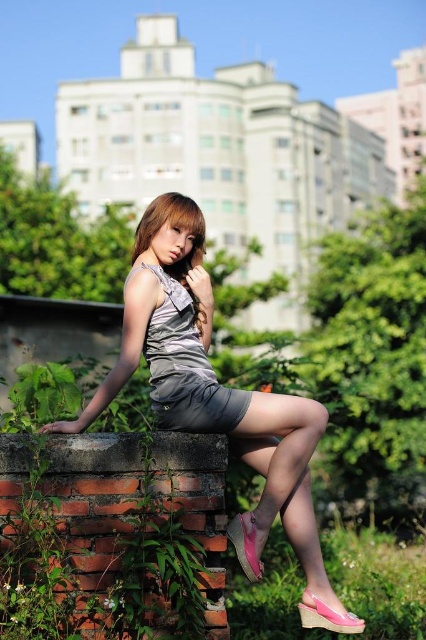
Question: Which point is farther to the camera?

Choices:
 (A) (199, 252)
 (B) (166, 353)
 (C) (252, 552)

Answer: (A)

Question: Which object appears closest to the camera in this image?

Choices:
 (A) satin gray dress at center
 (B) satin dress at center

Answer: (B)

Question: Among these objects, which one is farthest from the camera?

Choices:
 (A) satin silver dress at center
 (B) satin dress at center

Answer: (A)

Question: From the image, what is the correct spatial relationship of satin gray dress at center in relation to satin dress at center?

Choices:
 (A) above
 (B) below

Answer: (B)

Question: Is satin gray dress at center closer to camera compared to satin silver dress at center?

Choices:
 (A) no
 (B) yes

Answer: (B)

Question: Considering the relative positions of satin gray dress at center and satin dress at center in the image provided, where is satin gray dress at center located with respect to satin dress at center?

Choices:
 (A) below
 (B) above

Answer: (A)